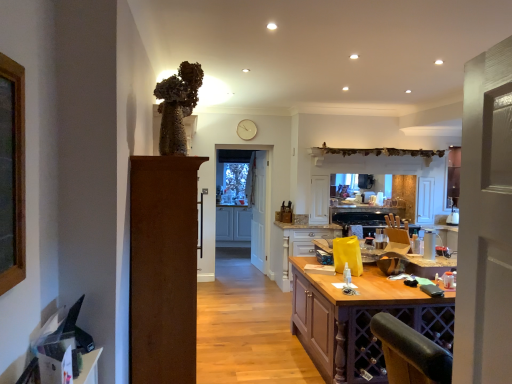
Question: Is wooden countertop at center, marked as the 1th cabinetry in a front-to-back arrangement, behind clear glass door at center?

Choices:
 (A) no
 (B) yes

Answer: (A)

Question: Does wooden countertop at center, which is the 1th cabinetry in right-to-left order, have a greater width compared to clear glass door at center?

Choices:
 (A) yes
 (B) no

Answer: (A)

Question: From a real-world perspective, is wooden countertop at center, which is the 1th cabinetry in right-to-left order, located higher than clear glass door at center?

Choices:
 (A) no
 (B) yes

Answer: (A)

Question: Does wooden countertop at center, marked as the 1th cabinetry in a front-to-back arrangement, have a lesser width compared to clear glass door at center?

Choices:
 (A) no
 (B) yes

Answer: (A)

Question: Is clear glass door at center inside wooden countertop at center, marked as the 1th cabinetry in a front-to-back arrangement?

Choices:
 (A) yes
 (B) no

Answer: (B)

Question: Is wooden countertop at center, marked as the 1th cabinetry in a front-to-back arrangement, with clear glass door at center?

Choices:
 (A) yes
 (B) no

Answer: (B)

Question: From a real-world perspective, is purple wood table at center under white wooden door at center, acting as the second door starting from the left?

Choices:
 (A) yes
 (B) no

Answer: (A)

Question: Is purple wood table at center facing towards white wooden door at center, acting as the second door starting from the left?

Choices:
 (A) no
 (B) yes

Answer: (B)

Question: Does purple wood table at center have a greater width compared to white wooden door at center, marked as the 2th door in a front-to-back arrangement?

Choices:
 (A) yes
 (B) no

Answer: (A)

Question: Are purple wood table at center and white wooden door at center, marked as the 2th door in a front-to-back arrangement, located far from each other?

Choices:
 (A) no
 (B) yes

Answer: (B)

Question: From the image's perspective, is purple wood table at center on top of white wooden door at center, acting as the second door starting from the left?

Choices:
 (A) yes
 (B) no

Answer: (B)

Question: Considering the relative sizes of purple wood table at center and white wooden door at center, the first door when ordered from right to left, in the image provided, is purple wood table at center thinner than white wooden door at center, the first door when ordered from right to left,?

Choices:
 (A) no
 (B) yes

Answer: (A)

Question: Is clear glass door at center further to camera compared to white wooden door at center, the first door when ordered from right to left?

Choices:
 (A) no
 (B) yes

Answer: (A)